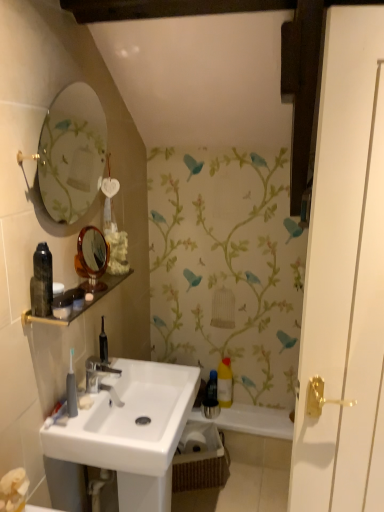
Question: Would you say woven brown basket at lower center is to the left or to the right of black glass shelf at upper left in the picture?

Choices:
 (A) left
 (B) right

Answer: (B)

Question: From the image's perspective, is woven brown basket at lower center positioned above or below black glass shelf at upper left?

Choices:
 (A) below
 (B) above

Answer: (A)

Question: Based on their relative distances, which object is nearer to the orange-brown wooden mirror at upper left?

Choices:
 (A) white glossy bath at lower right
 (B) yellow plastic bottle at center
 (C) white glossy door at right
 (D) white glossy sink at center
 (E) shiny black spray can at left, the 1th toiletry viewed from the top

Answer: (E)

Question: Based on their relative distances, which object is nearer to the white glossy sink at center?

Choices:
 (A) matte black container at upper left, which is the 2th toiletry from bottom to top
 (B) silver metallic faucet at center
 (C) yellow plastic bottle at center
 (D) white glossy bath at lower right
 (E) orange-brown wooden mirror at upper left

Answer: (B)